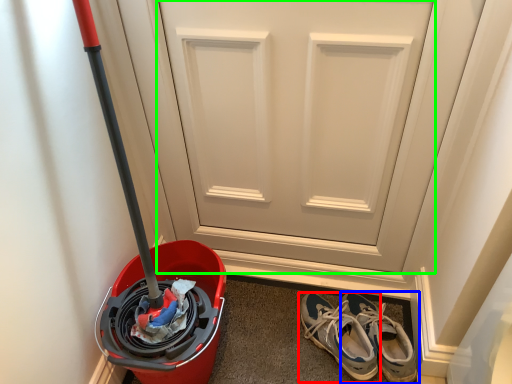
Question: Considering the real-world distances, which object is closest to footwear (highlighted by a red box)? footwear (highlighted by a blue box) or door (highlighted by a green box).

Choices:
 (A) footwear
 (B) door

Answer: (A)